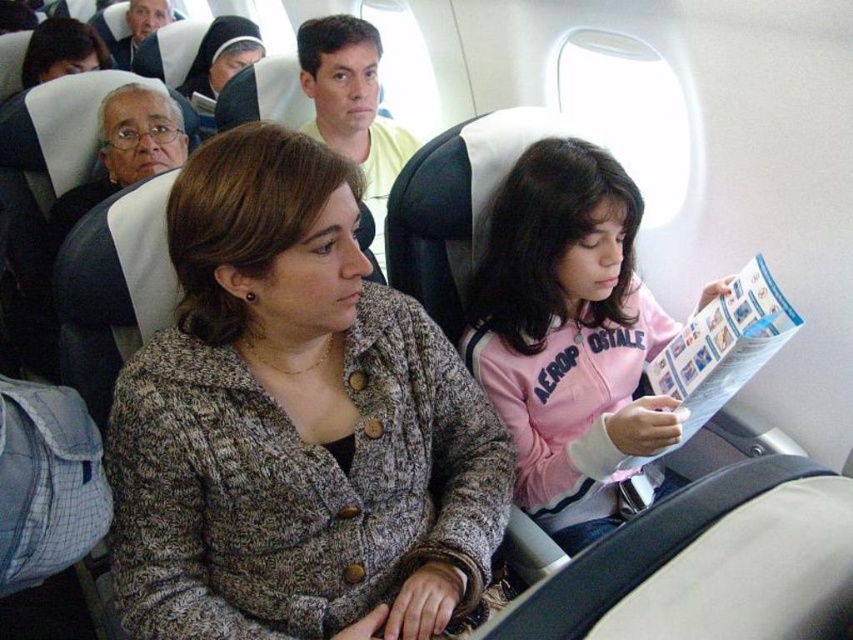
Question: Among these points, which one is nearest to the camera?

Choices:
 (A) (384, 266)
 (B) (618, 417)
 (C) (390, 474)

Answer: (C)

Question: Is blue glossy magazine at center right wider than yellow cotton shirt at center?

Choices:
 (A) yes
 (B) no

Answer: (B)

Question: Can you confirm if knitted gray sweater at center is thinner than pink fleece jacket at center?

Choices:
 (A) yes
 (B) no

Answer: (B)

Question: Which object appears closest to the camera in this image?

Choices:
 (A) yellow cotton shirt at center
 (B) pink fleece jacket at center
 (C) blue glossy magazine at center right

Answer: (B)

Question: Which point is farther to the camera?

Choices:
 (A) (593, 486)
 (B) (666, 451)
 (C) (126, 440)

Answer: (A)

Question: Can you confirm if pink fleece jacket at center is thinner than yellow cotton shirt at center?

Choices:
 (A) yes
 (B) no

Answer: (B)